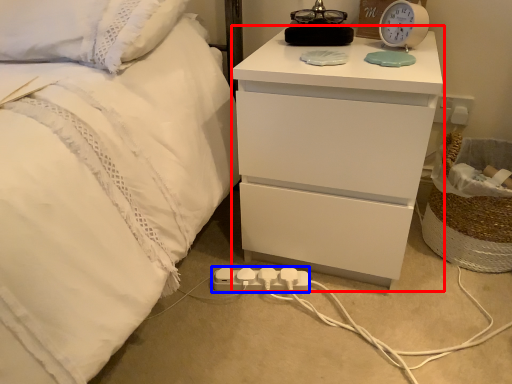
Question: Which point is further to the camera, nightstand (highlighted by a red box) or extension cord (highlighted by a blue box)?

Choices:
 (A) nightstand
 (B) extension cord

Answer: (B)